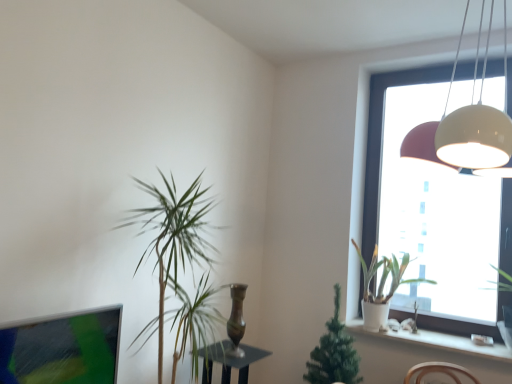
This screenshot has width=512, height=384. Identify the location of green leafy plant at left, which is counted as the third houseplant, starting from the right. (178, 256).

What is the approximate width of white matte pot at window, which is counted as the 2th houseplant, starting from the right?

white matte pot at window, which is counted as the 2th houseplant, starting from the right, is 14.30 inches in width.

This screenshot has width=512, height=384. Identify the location of green leafy plant at left, which is counted as the third houseplant, starting from the right. (178, 256).

From a real-world perspective, is white glossy window at upper right under green leafy plant at window, positioned as the third houseplant in left-to-right order?

Actually, white glossy window at upper right is physically above green leafy plant at window, positioned as the third houseplant in left-to-right order, in the real world.

Which is correct: white glossy window at upper right is inside green leafy plant at window, positioned as the third houseplant in left-to-right order, or outside of it?

white glossy window at upper right is not enclosed by green leafy plant at window, positioned as the third houseplant in left-to-right order.

Which object is positioned more to the right, white glossy window at upper right or green leafy plant at window, which is the first houseplant from right to left?

green leafy plant at window, which is the first houseplant from right to left, is more to the right.

Considering the relative sizes of white glossy window at upper right and green leafy plant at window, positioned as the third houseplant in left-to-right order, in the image provided, is white glossy window at upper right bigger than green leafy plant at window, positioned as the third houseplant in left-to-right order,?

Yes.

Do you think green leafy plant at window, positioned as the third houseplant in left-to-right order, is within bronze metallic vase at center, or outside of it?

green leafy plant at window, positioned as the third houseplant in left-to-right order, is outside bronze metallic vase at center.

Would you consider green leafy plant at window, which is the first houseplant from right to left, to be distant from bronze metallic vase at center?

That's right, there is a large distance between green leafy plant at window, which is the first houseplant from right to left, and bronze metallic vase at center.

Which object is wider, green leafy plant at window, which is the first houseplant from right to left, or bronze metallic vase at center?

Wider between the two is green leafy plant at window, which is the first houseplant from right to left.

From the image's perspective, would you say green leafy plant at window, which is the first houseplant from right to left, is shown under bronze metallic vase at center?

Incorrect, from the image's perspective, green leafy plant at window, which is the first houseplant from right to left, is higher than bronze metallic vase at center.

From the picture: Is matte white pendant light at upper right positioned beyond the bounds of white ceramic pot at lower right?

Yes, matte white pendant light at upper right is located beyond the bounds of white ceramic pot at lower right.

In terms of height, does matte white pendant light at upper right look taller or shorter compared to white ceramic pot at lower right?

In the image, matte white pendant light at upper right appears to be taller than white ceramic pot at lower right.

What are the coordinates of `window sill below the matte white pendant light at upper right (from the image's perspective)` in the screenshot? It's located at (437, 341).

Measure the distance between green leafy plant at left, which is counted as the third houseplant, starting from the right, and white ceramic pot at lower right.

4.21 feet.

Between green leafy plant at left, which is the first houseplant from left to right, and white ceramic pot at lower right, which one has larger size?

green leafy plant at left, which is the first houseplant from left to right, is bigger.

Can you tell me how much green leafy plant at left, which is counted as the third houseplant, starting from the right, and white ceramic pot at lower right differ in facing direction?

They differ by 89.3 degrees in their facing directions.

Between point (195, 229) and point (466, 350), which one is positioned in front?

Point (195, 229)

From the picture: From the image's perspective, relative to green leafy plant at left, which is the first houseplant from left to right, is white ceramic pot at lower right above or below?

Based on their image positions, white ceramic pot at lower right is located beneath green leafy plant at left, which is the first houseplant from left to right.

Is the surface of white ceramic pot at lower right in direct contact with green leafy plant at left, which is counted as the third houseplant, starting from the right?

white ceramic pot at lower right and green leafy plant at left, which is counted as the third houseplant, starting from the right, are clearly separated.

Is white ceramic pot at lower right to the right of green leafy plant at left, which is counted as the third houseplant, starting from the right, from the viewer's perspective?

Yes.

Does point (364, 330) lie in front of point (201, 250)?

No, (364, 330) is further to viewer.

Is white matte pot at window, which is counted as the 2th houseplant, starting from the right, facing away from matte white pendant light at upper right?

No.

Is the surface of white matte pot at window, which is counted as the 2th houseplant, starting from the right, in direct contact with matte white pendant light at upper right?

No, white matte pot at window, which is counted as the 2th houseplant, starting from the right, is not beside matte white pendant light at upper right.

From the image's perspective, is white matte pot at window, arranged as the second houseplant when viewed from the left, positioned above or below matte white pendant light at upper right?

Clearly, from the image's perspective, white matte pot at window, arranged as the second houseplant when viewed from the left, is below matte white pendant light at upper right.

Is green leafy plant at left, which is the first houseplant from left to right, positioned with its back to green leafy plant at window, positioned as the third houseplant in left-to-right order?

No.

Does green leafy plant at left, which is the first houseplant from left to right, have a lesser width compared to green leafy plant at window, which is the first houseplant from right to left?

No.

Which is less distant, (209, 199) or (509, 349)?

Point (209, 199) is positioned farther from the camera compared to point (509, 349).

From the image's perspective, would you say green leafy plant at left, which is counted as the third houseplant, starting from the right, is positioned over green leafy plant at window, positioned as the third houseplant in left-to-right order?

Yes, from the image's perspective, green leafy plant at left, which is counted as the third houseplant, starting from the right, is over green leafy plant at window, positioned as the third houseplant in left-to-right order.

Where is `window above the green leafy plant at window, positioned as the third houseplant in left-to-right order (from a real-world perspective)`? This screenshot has height=384, width=512. window above the green leafy plant at window, positioned as the third houseplant in left-to-right order (from a real-world perspective) is located at coordinates (382, 139).

Image resolution: width=512 pixels, height=384 pixels. Identify the location of glass vase located behind the green leafy plant at window, which is the first houseplant from right to left. pos(236,319).

Estimate the real-world distances between objects in this image. Which object is further from white glossy window at upper right, green leafy plant at window, positioned as the third houseplant in left-to-right order, or white ceramic pot at lower right?

green leafy plant at window, positioned as the third houseplant in left-to-right order, is further to white glossy window at upper right.

Which object lies further to the anchor point matte white pendant light at upper right, green leafy plant at window, which is the first houseplant from right to left, or white glossy window at upper right?

Among the two, green leafy plant at window, which is the first houseplant from right to left, is located further to matte white pendant light at upper right.

Looking at the image, which one is located closer to bronze metallic vase at center, green leafy plant at left, which is the first houseplant from left to right, or white glossy window at upper right?

green leafy plant at left, which is the first houseplant from left to right, is positioned closer to the anchor bronze metallic vase at center.

Which object lies further to the anchor point white glossy window at upper right, green leafy plant at left, which is counted as the third houseplant, starting from the right, or bronze metallic vase at center?

The object further to white glossy window at upper right is green leafy plant at left, which is counted as the third houseplant, starting from the right.

Considering their positions, is white glossy window at upper right positioned further to white ceramic pot at lower right than white matte pot at window, which is counted as the 2th houseplant, starting from the right?

white glossy window at upper right.

Estimate the real-world distances between objects in this image. Which object is closer to green leafy plant at left, which is the first houseplant from left to right, matte white pendant light at upper right or white glossy window at upper right?

matte white pendant light at upper right lies closer to green leafy plant at left, which is the first houseplant from left to right, than the other object.

When comparing their distances from green leafy plant at left, which is counted as the third houseplant, starting from the right, does matte white pendant light at upper right or white ceramic pot at lower right seem further?

The object further to green leafy plant at left, which is counted as the third houseplant, starting from the right, is white ceramic pot at lower right.

Which object lies nearer to the anchor point green leafy plant at window, positioned as the third houseplant in left-to-right order, matte white pendant light at upper right or bronze metallic vase at center?

bronze metallic vase at center is closer to green leafy plant at window, positioned as the third houseplant in left-to-right order.

Where is `window sill located between white matte pot at window, which is counted as the 2th houseplant, starting from the right, and green leafy plant at window, positioned as the third houseplant in left-to-right order, in the left-right direction`? window sill located between white matte pot at window, which is counted as the 2th houseplant, starting from the right, and green leafy plant at window, positioned as the third houseplant in left-to-right order, in the left-right direction is located at coordinates (437, 341).

Identify the location of lamp between green leafy plant at left, which is counted as the third houseplant, starting from the right, and white glossy window at upper right, in the horizontal direction. tap(462, 131).

You are a GUI agent. You are given a task and a screenshot of the screen. Output one action in this format:
    pyautogui.click(x=<x>, y=<y>)
    Task: Click on the window sill between bronze metallic vase at center and green leafy plant at window, positioned as the third houseplant in left-to-right order, from left to right
    Image resolution: width=512 pixels, height=384 pixels.
    Given the screenshot: What is the action you would take?
    pyautogui.click(x=437, y=341)

Identify the location of window between bronze metallic vase at center and green leafy plant at window, which is the first houseplant from right to left. (382, 139).